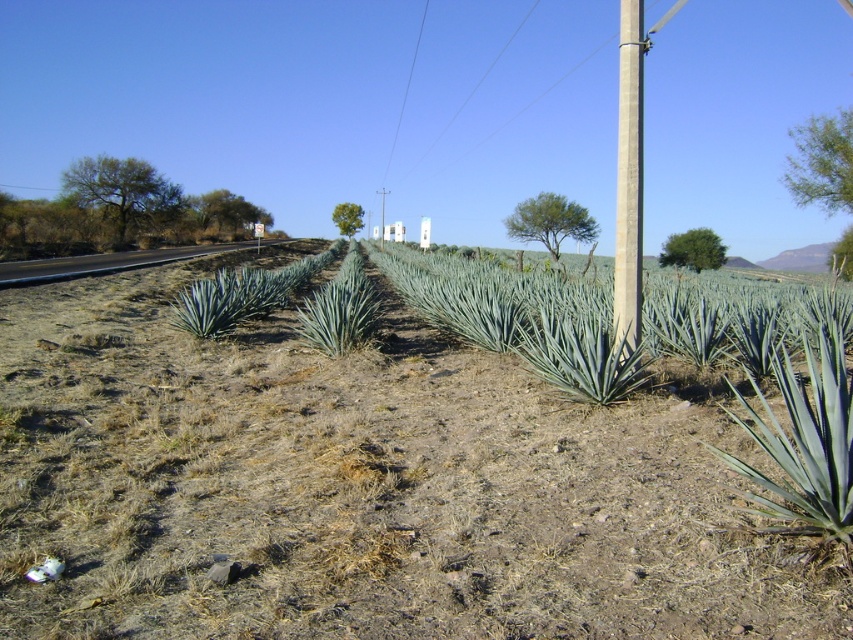
You are standing in the rural landscape depicted in the scene. There is a point marked at coordinates point (432, 516). If you want to reach this point as quickly as possible, which direction should you move in relation to your current position?

The point (432, 516) is 4.22 meters away from the viewer, so you should move directly towards it in the direction it is located relative to your current position to reach it as quickly as possible.

You are standing at the edge of the field and want to walk to the paved road on the left. Which direction should you go relative to the green leafy grass at center?

The green leafy grass at center is located at point (357, 486), so you should head towards the left direction to reach the paved road.